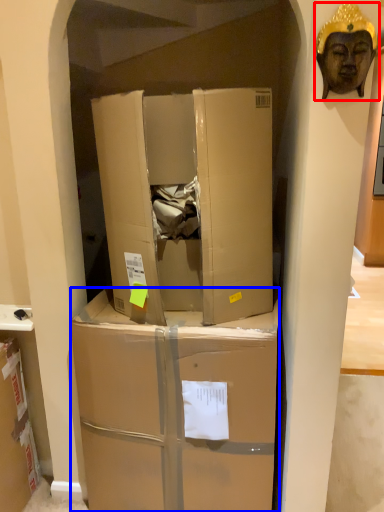
Question: Which object is closer to the camera taking this photo, person (highlighted by a red box) or box (highlighted by a blue box)?

Choices:
 (A) person
 (B) box

Answer: (A)